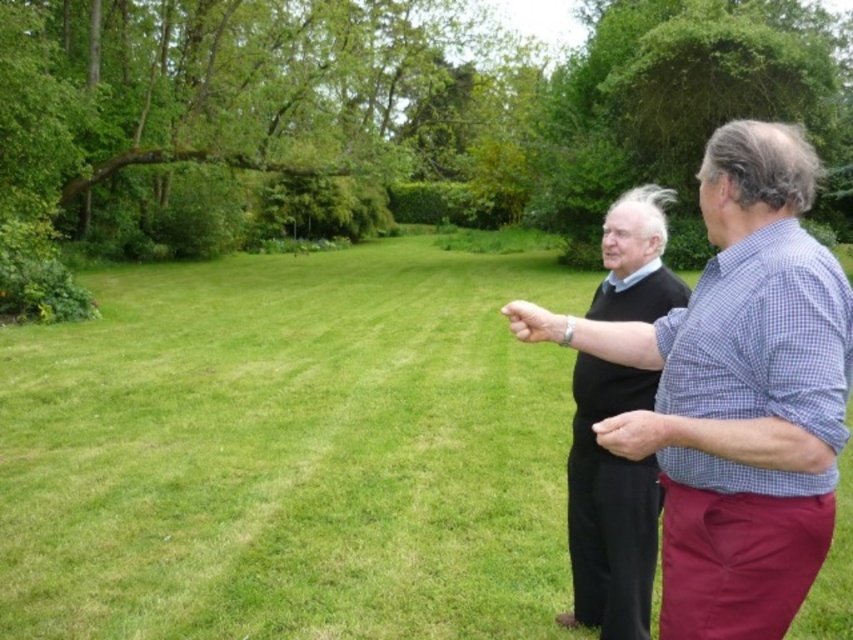
You are a gardener trying to mow the lawn. You see the green grass at center and the black sweater at center. Which area should you avoid mowing to prevent damaging any clothing?

You should avoid mowing the area where the black sweater at center is located to prevent damaging the clothing, as the green grass at center is the actual lawn area intended for mowing.

You are a photographer trying to capture a photo of the black sweater at center and the green grass at center. Which object will occupy more area in your photo?

The green grass at center is bigger than the black sweater at center, so it will occupy more area in the photo.

You are a photographer trying to capture a photo of the black sweater at center and the green grass at center. Based on their positions, which object should you focus on first if you want to include both in your frame?

The green grass at center is positioned on the left side of the black sweater at center, so you should focus on the black sweater at center first to ensure both are in frame.